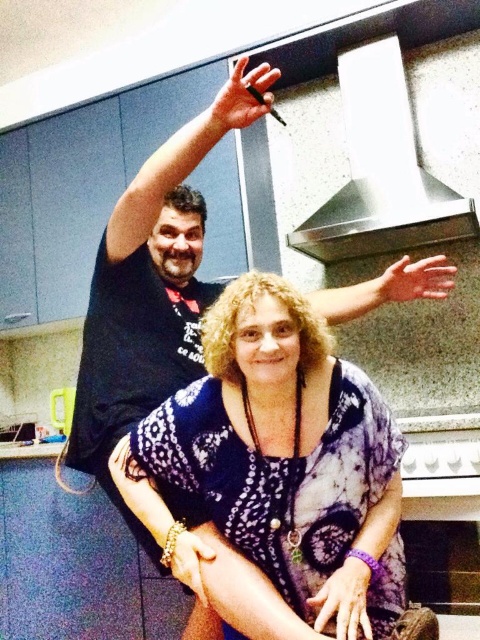
You are a fashion designer observing the image of two people in a kitchen. You notice the purple fabric hand at center and the dry skin at upper center. Which object is shorter in height?

The purple fabric hand at center is shorter than dry skin at upper center.

You are a fashion designer observing the image of two people in a kitchen. You notice the purple fabric hand at center and the dry skin at upper center. Which object is smaller in size?

The purple fabric hand at center is smaller in size compared to the dry skin at upper center.